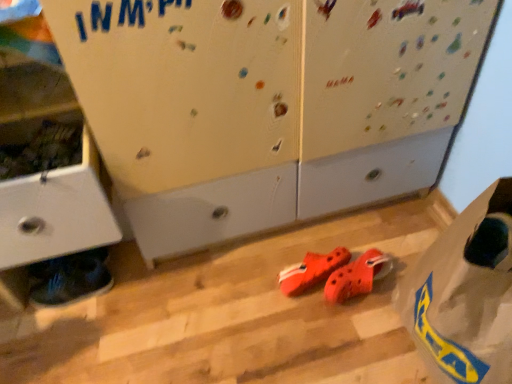
Question: Is orange rubber clogs at center, placed as the first footwear when sorted from right to left, taller or shorter than shiny blue sneakers at lower left, which appears as the third footwear when viewed from the right?

Choices:
 (A) short
 (B) tall

Answer: (A)

Question: Relative to shiny blue sneakers at lower left, which appears as the third footwear when viewed from the right, is orange rubber clogs at center, the 3th footwear in the left-to-right sequence, in front or behind?

Choices:
 (A) front
 (B) behind

Answer: (A)

Question: Considering the real-world distances, which object is closest to the transparent plastic bag at lower right?

Choices:
 (A) orange rubber clogs at center, the 3th footwear in the left-to-right sequence
 (B) rubber/crocodile-patterned shoes at center, placed as the 2th footwear when sorted from right to left
 (C) matte white cabinet at left
 (D) shiny blue sneakers at lower left, which appears as the third footwear when viewed from the right

Answer: (A)

Question: Which is farther from the orange rubber clogs at center, the 3th footwear in the left-to-right sequence?

Choices:
 (A) rubber/crocodile-patterned shoes at center, the 2th footwear positioned from the left
 (B) transparent plastic bag at lower right
 (C) shiny blue sneakers at lower left, which appears as the third footwear when viewed from the right
 (D) matte white cabinet at left

Answer: (D)